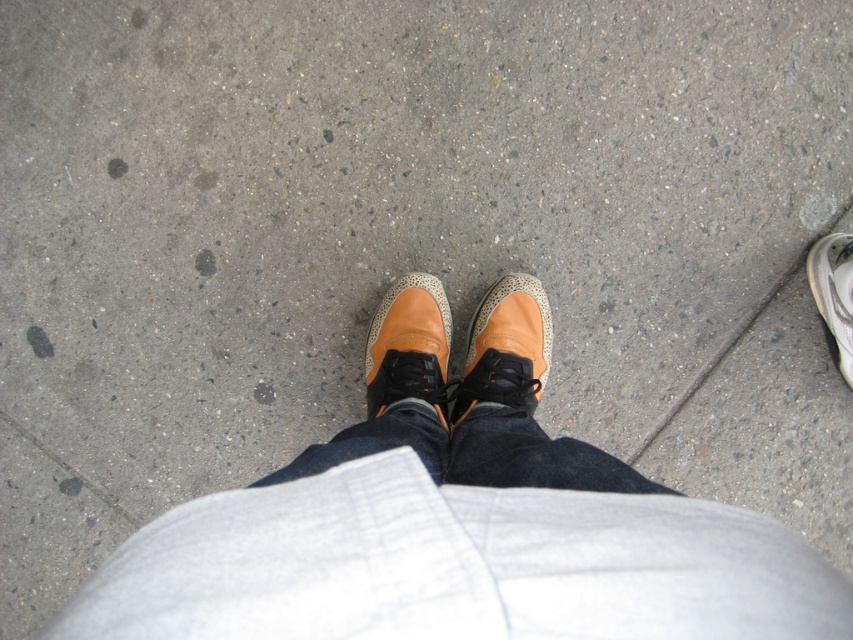
Question: Which of the following is the closest to the observer?

Choices:
 (A) (813, 292)
 (B) (468, 349)
 (C) (366, 396)

Answer: (B)

Question: Estimate the real-world distances between objects in this image. Which object is farther from the tan textured sneaker at center?

Choices:
 (A) white textured sneaker at lower right
 (B) tan suede sneaker at center

Answer: (A)

Question: Can you confirm if tan textured sneaker at center is positioned above white textured sneaker at lower right?

Choices:
 (A) no
 (B) yes

Answer: (A)

Question: Considering the relative positions of tan textured sneaker at center and tan suede sneaker at center in the image provided, where is tan textured sneaker at center located with respect to tan suede sneaker at center?

Choices:
 (A) left
 (B) right

Answer: (B)

Question: Which object appears farthest from the camera in this image?

Choices:
 (A) white textured sneaker at lower right
 (B) tan textured sneaker at center
 (C) tan suede sneaker at center

Answer: (A)

Question: Can you confirm if tan textured sneaker at center is bigger than tan suede sneaker at center?

Choices:
 (A) yes
 (B) no

Answer: (A)